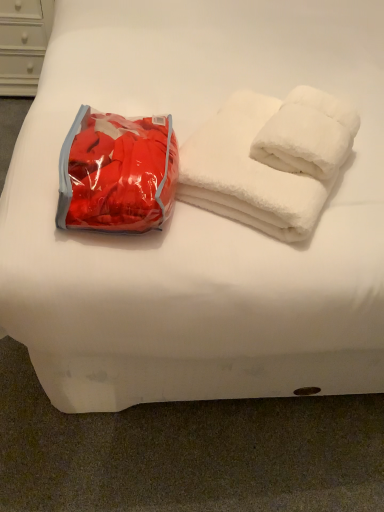
The image size is (384, 512). Describe the element at coordinates (248, 173) in the screenshot. I see `white fluffy towels at upper right` at that location.

The width and height of the screenshot is (384, 512). What are the coordinates of `white fluffy towels at upper right` in the screenshot? It's located at (248, 173).

What is the approximate height of white fluffy towels at upper right?

white fluffy towels at upper right is 5.56 inches in height.

Describe the element at coordinates (117, 173) in the screenshot. The height and width of the screenshot is (512, 384). I see `matte red bean bag chair at left` at that location.

The image size is (384, 512). In order to click on matte red bean bag chair at left in this screenshot , I will do `click(117, 173)`.

The image size is (384, 512). I want to click on white fluffy towels at upper right, so click(x=248, y=173).

Between white fluffy towels at upper right and matte red bean bag chair at left, which one appears on the left side from the viewer's perspective?

From the viewer's perspective, matte red bean bag chair at left appears more on the left side.

Considering the relative positions of white fluffy towels at upper right and matte red bean bag chair at left in the image provided, is white fluffy towels at upper right behind matte red bean bag chair at left?

Yes, white fluffy towels at upper right is behind matte red bean bag chair at left.

Is point (233, 123) closer or farther from the camera than point (137, 140)?

Point (233, 123) appears to be farther away from the viewer than point (137, 140).

From the image's perspective, who appears lower, white fluffy towels at upper right or matte red bean bag chair at left?

From the image's view, matte red bean bag chair at left is below.

From a real-world perspective, does white fluffy towels at upper right stand above matte red bean bag chair at left?

Incorrect, from a real-world perspective, white fluffy towels at upper right is lower than matte red bean bag chair at left.

Considering the sizes of white fluffy towels at upper right and matte red bean bag chair at left in the image, is white fluffy towels at upper right wider or thinner than matte red bean bag chair at left?

white fluffy towels at upper right is wider than matte red bean bag chair at left.

Who is taller, white fluffy towels at upper right or matte red bean bag chair at left?

With more height is white fluffy towels at upper right.

Can you confirm if white fluffy towels at upper right is smaller than matte red bean bag chair at left?

Incorrect, white fluffy towels at upper right is not smaller in size than matte red bean bag chair at left.

Can we say white fluffy towels at upper right lies outside matte red bean bag chair at left?

That's correct, white fluffy towels at upper right is outside of matte red bean bag chair at left.

Is white fluffy towels at upper right directly adjacent to matte red bean bag chair at left?

white fluffy towels at upper right is not next to matte red bean bag chair at left, and they're not touching.

Does white fluffy towels at upper right turn towards matte red bean bag chair at left?

No.

What's the angular difference between white fluffy towels at upper right and matte red bean bag chair at left's facing directions?

The angle between the facing direction of white fluffy towels at upper right and the facing direction of matte red bean bag chair at left is 26 degrees.

Identify the location of bean bag chair on the left of the white fluffy towels at upper right. (117, 173).

Which object is positioned more to the left, matte red bean bag chair at left or white fluffy towels at upper right?

From the viewer's perspective, matte red bean bag chair at left appears more on the left side.

Considering the positions of objects matte red bean bag chair at left and white fluffy towels at upper right in the image provided, who is behind, matte red bean bag chair at left or white fluffy towels at upper right?

white fluffy towels at upper right.

Which is further, (141, 201) or (258, 207)?

Point (258, 207)

From the image's perspective, is matte red bean bag chair at left positioned above or below white fluffy towels at upper right?

matte red bean bag chair at left is below white fluffy towels at upper right.

From the picture: From a real-world perspective, is matte red bean bag chair at left physically above white fluffy towels at upper right?

Yes, from a real-world perspective, matte red bean bag chair at left is above white fluffy towels at upper right.

Considering the sizes of objects matte red bean bag chair at left and white fluffy towels at upper right in the image provided, who is thinner, matte red bean bag chair at left or white fluffy towels at upper right?

matte red bean bag chair at left is thinner.

Between matte red bean bag chair at left and white fluffy towels at upper right, which one has less height?

matte red bean bag chair at left.

Considering the sizes of matte red bean bag chair at left and white fluffy towels at upper right in the image, is matte red bean bag chair at left bigger or smaller than white fluffy towels at upper right?

Clearly, matte red bean bag chair at left is smaller in size than white fluffy towels at upper right.

Is white fluffy towels at upper right surrounded by matte red bean bag chair at left?

No.

Is matte red bean bag chair at left positioned far away from white fluffy towels at upper right?

No, matte red bean bag chair at left is not far from white fluffy towels at upper right.

Is matte red bean bag chair at left facing towards white fluffy towels at upper right?

No, matte red bean bag chair at left is not facing towards white fluffy towels at upper right.

What's the angular difference between matte red bean bag chair at left and white fluffy towels at upper right's facing directions?

The angular difference between matte red bean bag chair at left and white fluffy towels at upper right is 26 degrees.

Locate an element on the screen. The image size is (384, 512). towel that is under the matte red bean bag chair at left (from a real-world perspective) is located at coordinates (248, 173).

Where is `bean bag chair below the white fluffy towels at upper right (from the image's perspective)`? This screenshot has width=384, height=512. bean bag chair below the white fluffy towels at upper right (from the image's perspective) is located at coordinates (117, 173).

Where is `bean bag chair that appears above the white fluffy towels at upper right (from a real-world perspective)`? Image resolution: width=384 pixels, height=512 pixels. bean bag chair that appears above the white fluffy towels at upper right (from a real-world perspective) is located at coordinates (117, 173).